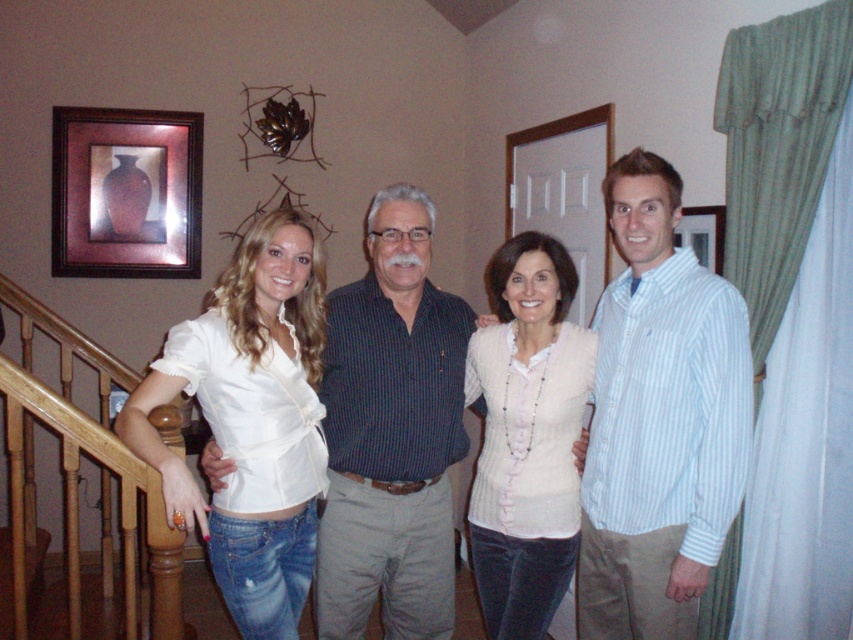
In the scene, there are two people wearing the white satin blouse at left and the pink textured sweater at center. Which clothing item is shorter in length?

The white satin blouse at left is shorter than the pink textured sweater at center.

You are a photographer setting up a shoot in this scene. You need to ensure that the white satin blouse at left is visible above the pink textured sweater at center in the final photo. Based on their positions, can you confirm if this arrangement is already achievable without adjusting their positions?

Yes, the white satin blouse at left is already positioned above the pink textured sweater at center, so no adjustments are needed for visibility.

Looking at this image, you are a delivery person who needs to place a small package between the pink textured sweater at center and the brown wooden picture frame at upper left. Can you fit the package in that space if it requires 2 meters of distance?

The pink textured sweater at center and brown wooden picture frame at upper left are 2.29 meters apart, so yes, the package requiring 2 meters of distance can fit between them since the available space is larger than needed.